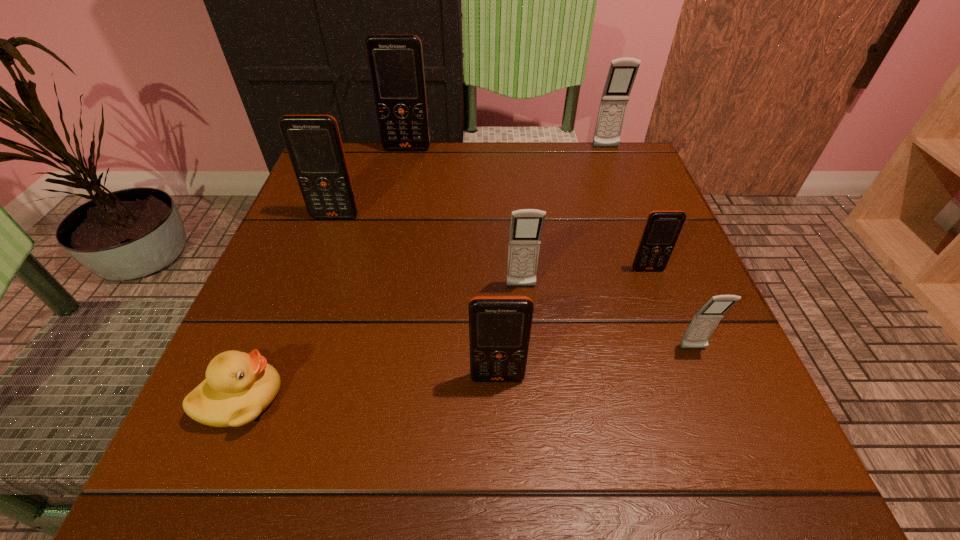
Find the location of a particular element. This screenshot has width=960, height=540. vacant region located on the screen of the second nearest orange cellular telephone is located at coordinates (714, 448).

Where is `vacant area located 0.050m on the front-facing side of the sixth farthest object`? The width and height of the screenshot is (960, 540). vacant area located 0.050m on the front-facing side of the sixth farthest object is located at coordinates (707, 381).

The image size is (960, 540). Identify the location of free spot located on the front-facing side of the shortest object. (363, 398).

Locate an element on the screen. object that is at the near edge is located at coordinates (238, 387).

Where is `duckling located in the left edge section of the desktop`? Image resolution: width=960 pixels, height=540 pixels. duckling located in the left edge section of the desktop is located at coordinates (238, 387).

Find the location of a particular element. Image resolution: width=960 pixels, height=540 pixels. object present at the far left corner is located at coordinates (395, 62).

The width and height of the screenshot is (960, 540). I want to click on object situated at the near left corner, so [x=238, y=387].

Identify the location of object that is at the far right corner. The width and height of the screenshot is (960, 540). (622, 72).

This screenshot has height=540, width=960. What are the coordinates of `vacant space at the far edge of the desktop` in the screenshot? It's located at (542, 166).

Find the location of `blank space at the near edge of the desktop`. blank space at the near edge of the desktop is located at coordinates (461, 470).